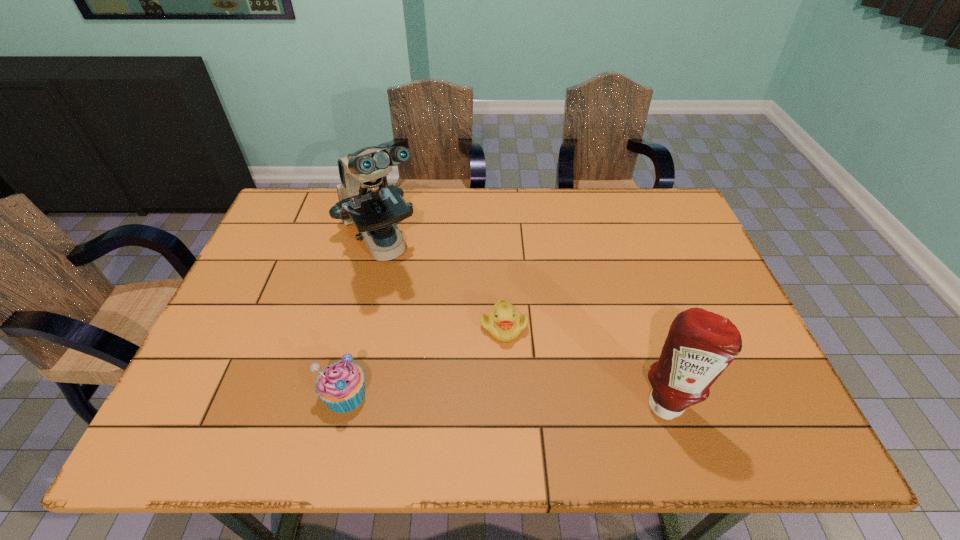
Locate an element on the screen. This screenshot has height=540, width=960. free spot on the desktop that is between the muffin and the second tallest object and is positioned through the eyepieces of the farthest object is located at coordinates (475, 397).

Identify the location of vacant space on the desktop that is between the muffin and the third shortest object and is positioned on the front-facing side of the second object from right to left. The image size is (960, 540). (546, 399).